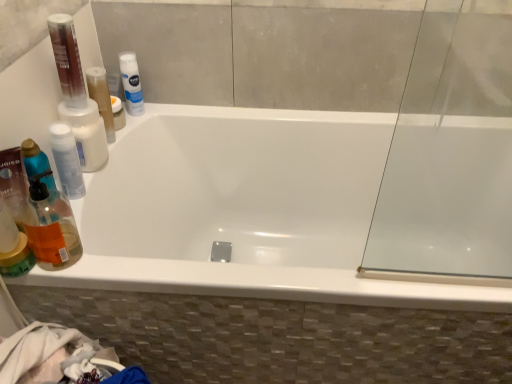
Identify the location of free space to the right of translucent orange liquid at left. This screenshot has width=512, height=384. (131, 271).